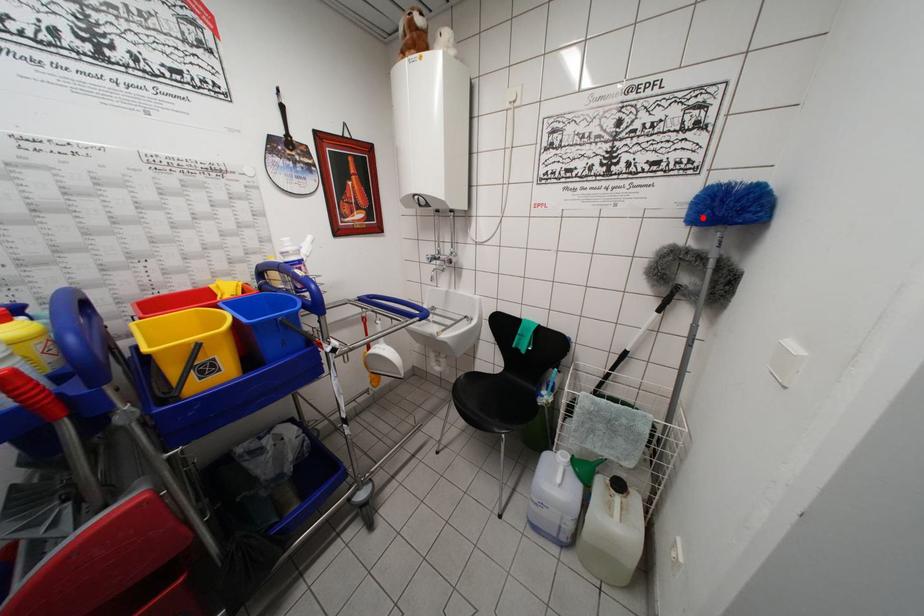
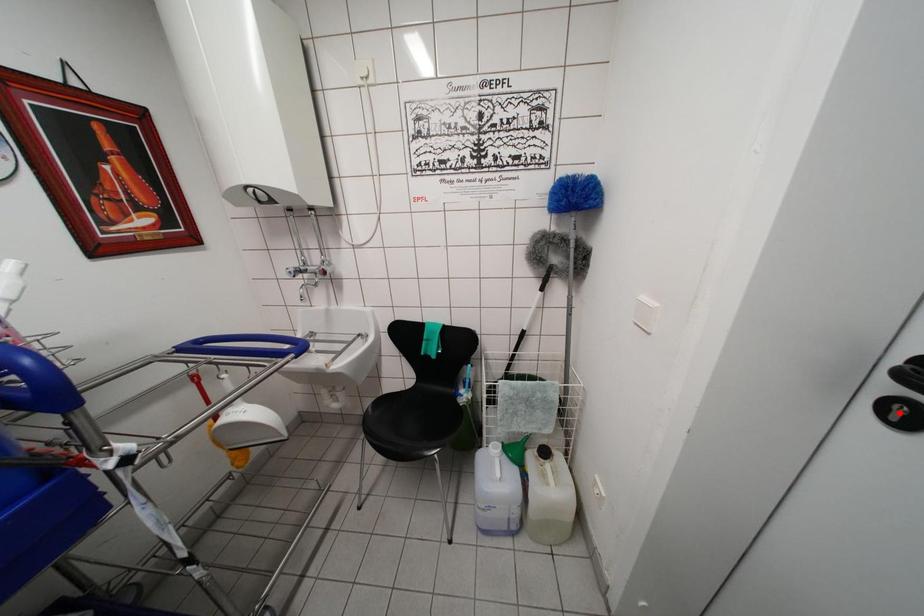
I am providing you with two images of the same scene from different viewpoints. A red point is marked on the first image and another point is marked on the second image. Are the points marked in image1 and image2 representing the same 3D position?

No